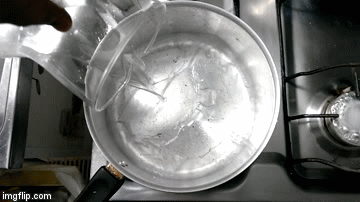
Locate an element on the screen. handle of pot is located at coordinates (92, 185).